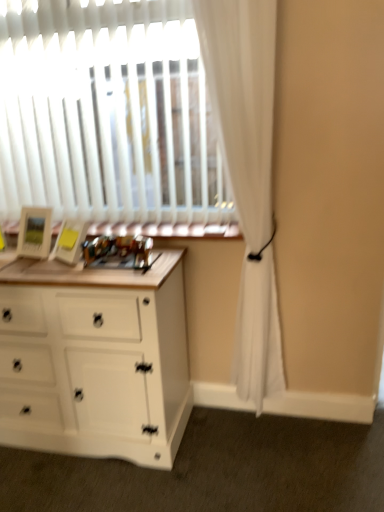
Question: From the image's perspective, is white matte chest of drawers at left on wooden frame at center?

Choices:
 (A) yes
 (B) no

Answer: (B)

Question: Would you say white matte chest of drawers at left is outside wooden frame at center?

Choices:
 (A) yes
 (B) no

Answer: (A)

Question: Is wooden frame at center at the back of white matte chest of drawers at left?

Choices:
 (A) no
 (B) yes

Answer: (A)

Question: Is white matte chest of drawers at left at the right side of wooden frame at center?

Choices:
 (A) yes
 (B) no

Answer: (B)

Question: Is the position of white matte chest of drawers at left more distant than that of wooden frame at center?

Choices:
 (A) no
 (B) yes

Answer: (A)

Question: Is white matte chest of drawers at left thinner than wooden frame at center?

Choices:
 (A) no
 (B) yes

Answer: (A)

Question: Does wooden frame at center have a lesser height compared to white sheer curtain at right?

Choices:
 (A) yes
 (B) no

Answer: (A)

Question: Are wooden frame at center and white sheer curtain at right located far from each other?

Choices:
 (A) no
 (B) yes

Answer: (A)

Question: From a real-world perspective, is wooden frame at center on top of white sheer curtain at right?

Choices:
 (A) no
 (B) yes

Answer: (A)

Question: Is wooden frame at center surrounding white sheer curtain at right?

Choices:
 (A) no
 (B) yes

Answer: (A)

Question: From the image's perspective, would you say wooden frame at center is positioned over white sheer curtain at right?

Choices:
 (A) no
 (B) yes

Answer: (B)

Question: Is wooden frame at center closer to camera compared to white sheer curtain at right?

Choices:
 (A) yes
 (B) no

Answer: (B)

Question: From the image's perspective, would you say white sheer curtain at right is positioned over wooden frame at center?

Choices:
 (A) no
 (B) yes

Answer: (A)